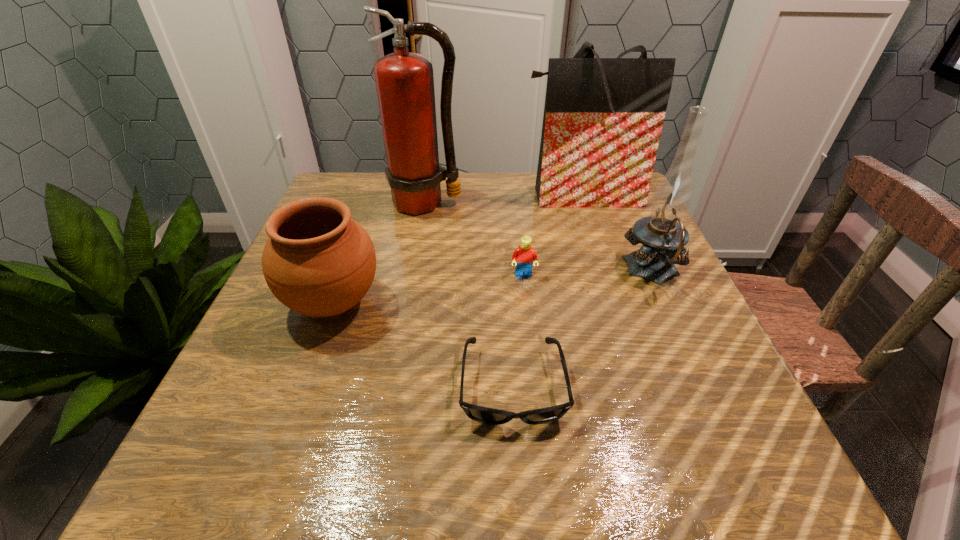
This screenshot has width=960, height=540. I want to click on free space located on the back of the pottery, so click(373, 191).

Locate an element on the screen. free space located 0.390m on the face of the fifth tallest object is located at coordinates (544, 465).

You are a GUI agent. You are given a task and a screenshot of the screen. Output one action in this format:
    pyautogui.click(x=<x>, y=<y>)
    Task: Click on the blank area located on the front-facing side of the shortest object
    This screenshot has width=960, height=540.
    Given the screenshot: What is the action you would take?
    pyautogui.click(x=517, y=465)

The image size is (960, 540). Find the location of `fire extinguisher located at the far edge`. fire extinguisher located at the far edge is located at coordinates (404, 81).

At what (x,y) coordinates should I click in order to perform the action: click on shopping bag situated at the far edge. Please return your answer as a coordinate pair (x, y). Looking at the image, I should click on click(603, 117).

Where is `object that is at the left edge`? object that is at the left edge is located at coordinates (318, 261).

Image resolution: width=960 pixels, height=540 pixels. What are the coordinates of `shopping bag located in the right edge section of the desktop` in the screenshot? It's located at (603, 117).

At what (x,y) coordinates should I click in order to perform the action: click on oil lamp positioned at the right edge. Please return your answer as a coordinate pair (x, y). The height and width of the screenshot is (540, 960). Looking at the image, I should click on (663, 235).

The height and width of the screenshot is (540, 960). I want to click on object that is at the far right corner, so click(603, 117).

Locate an element on the screen. vacant space at the far edge of the desktop is located at coordinates (391, 199).